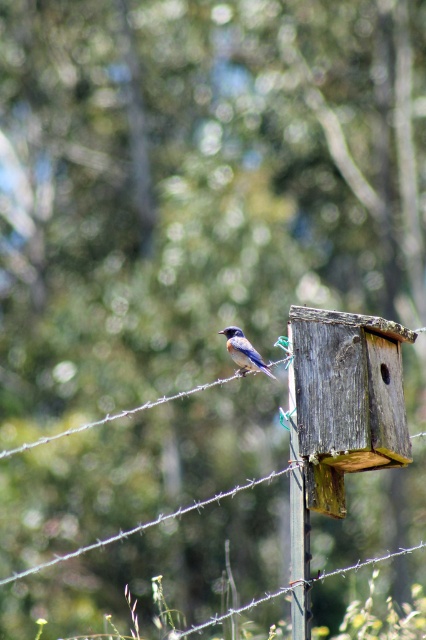
Question: Which point is farther to the camera?

Choices:
 (A) wooden post at center
 (B) blue glossy bird at center

Answer: (B)

Question: Among these objects, which one is nearest to the camera?

Choices:
 (A) blue glossy bird at center
 (B) wooden post at center

Answer: (B)

Question: Where is wooden post at center located in relation to blue glossy bird at center in the image?

Choices:
 (A) right
 (B) left

Answer: (A)

Question: Which point is closer to the camera?

Choices:
 (A) blue glossy bird at center
 (B) wooden post at center

Answer: (B)

Question: Can you confirm if wooden post at center is positioned to the right of blue glossy bird at center?

Choices:
 (A) no
 (B) yes

Answer: (B)

Question: Is wooden post at center positioned at the back of blue glossy bird at center?

Choices:
 (A) no
 (B) yes

Answer: (A)